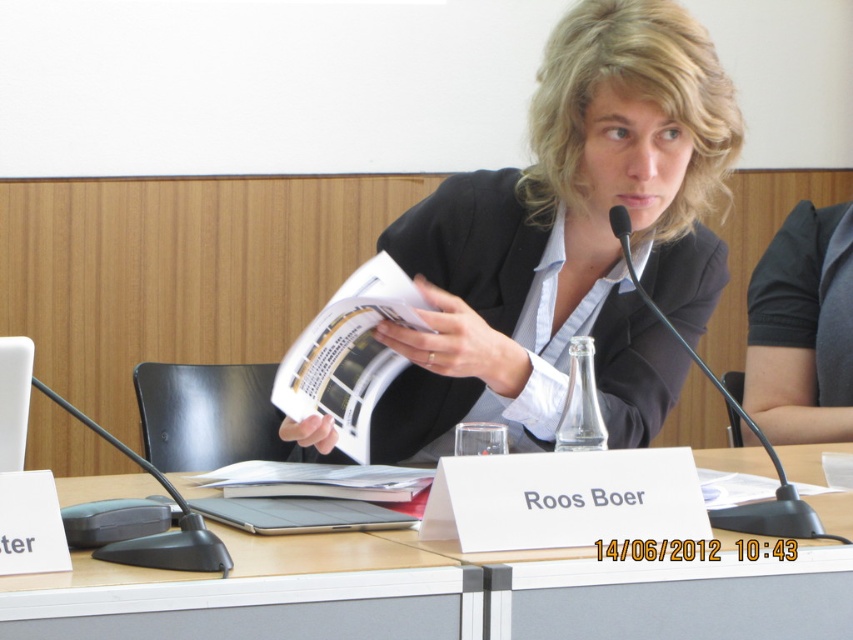
You are standing in a conference room and need to place a 1.2 meter long banner on the wall behind the table. The banner must be placed at point marked as point (186, 564). Can you determine if the banner will fit vertically at this point?

The distance of point (186, 564) from viewer is 1.13 meters. Since the banner is 1.2 meters long and the distance is shorter than the banner length, the banner cannot be placed vertically at this point.